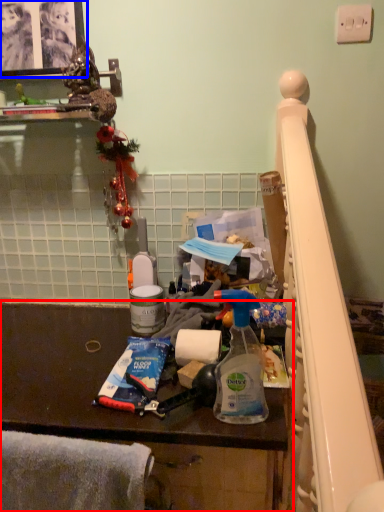
Question: Which object appears closest to the camera in this image, furniture (highlighted by a red box) or picture frame (highlighted by a blue box)?

Choices:
 (A) furniture
 (B) picture frame

Answer: (A)